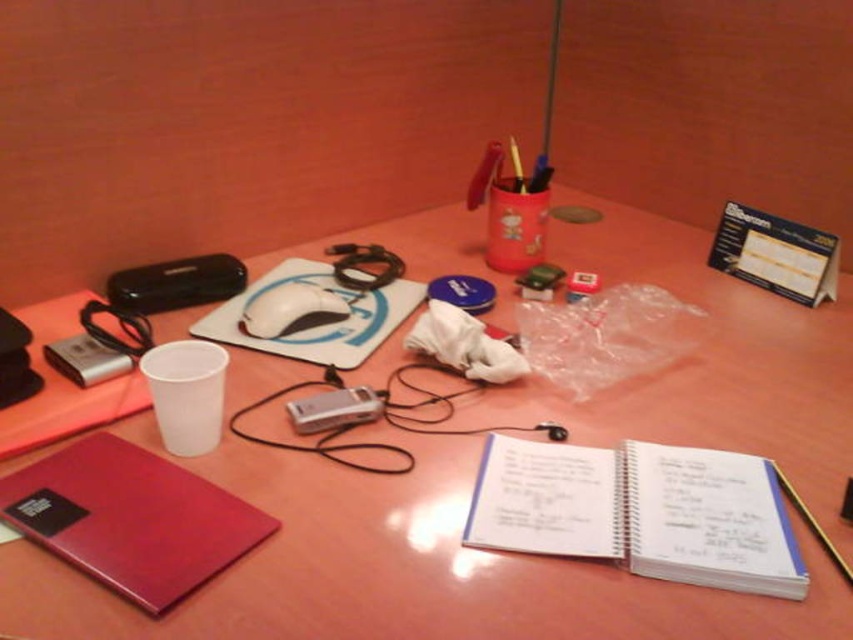
You are looking at the desk and see two points marked on it. Which point is closer to you, point (741, 513) or point (65, 518)?

Point (65, 518) is closer to you because the description states that point (741, 513) is further away from the camera than point (65, 518).

You are standing in front of the desk and want to reach both points on the desk surface. Which point, point (256, 320) or point (366, 416), is closer to you?

Point (256, 320) is closer to you because it is further to the camera than point (366, 416).

You need to place both the white matte mouse at center and the silver metallic camera at center into a storage box. The box can only fit one of them. Which object should you choose based on their sizes?

The white matte mouse at center is larger in size than the silver metallic camera at center, so you should choose the silver metallic camera at center to fit into the storage box.